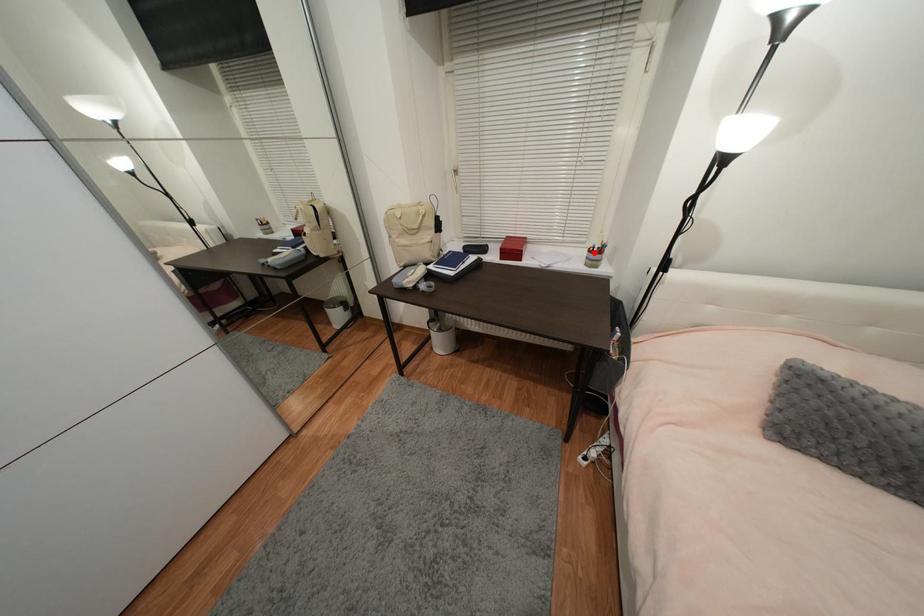
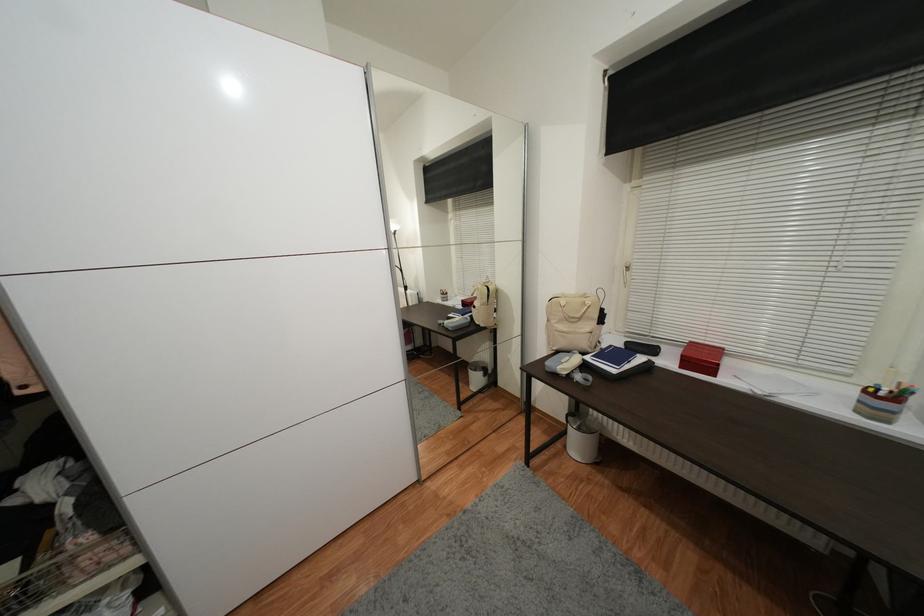
Question: I am providing you with two images of the same scene from different viewpoints. A red point is shown in image1. For the corresponding object point in image2, is it positioned nearer or farther from the camera?

Choices:
 (A) Nearer
 (B) Farther

Answer: (B)